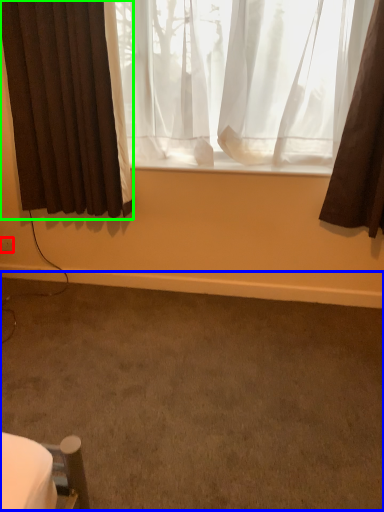
Question: Which object is positioned farthest from electric outlet (highlighted by a red box)? Select from plain (highlighted by a blue box) and curtain (highlighted by a green box).

Choices:
 (A) plain
 (B) curtain

Answer: (A)